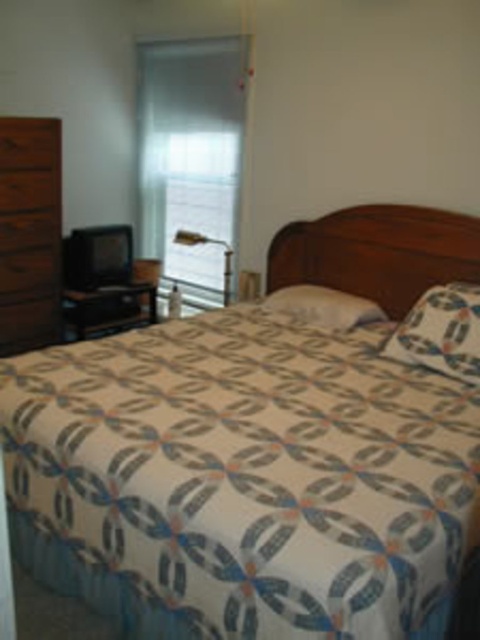
You are a delivery person who needs to place a package that is 1.6 meters long between the patterned fabric pillow at center and the metallic gold lamp at upper center. Can you fit the package between them without bending it?

The distance between the patterned fabric pillow at center and the metallic gold lamp at upper center is 1.59 meters, which is slightly shorter than the 1.6 meter package. Therefore, the package cannot be placed between them without bending it.

You are a guest in this bedroom and want to place a small vase on the dresser. You notice the patterned fabric pillow at center and the metallic gold lamp at upper center. Which object should you move to make space?

You should move the metallic gold lamp at upper center because the patterned fabric pillow at center is in front of it, meaning the lamp is behind the pillow and likely has more space around it.

You are moving furniture and need to know which object takes up more space in the room. Based on the scene, which one is bigger between the patterned fabric bed at center and the wooden dresser at left?

The patterned fabric bed at center has a larger size compared to wooden dresser at left, so the patterned fabric bed at center takes up more space in the room.